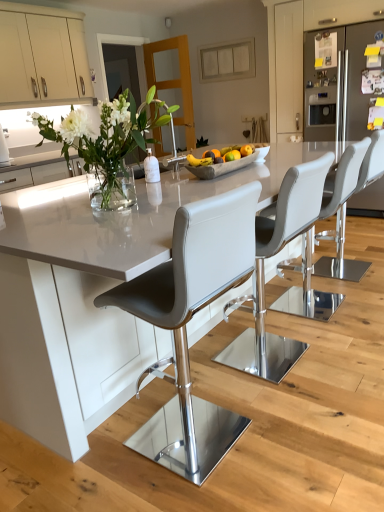
Question: Would you say white leather bar stool at center, which is the second chair in front-to-back order, is part of matte gray bar stool at center, which ranks as the fourth chair in front-to-back order,'s contents?

Choices:
 (A) no
 (B) yes

Answer: (A)

Question: Is matte gray bar stool at center, which ranks as the fourth chair in front-to-back order, at the left side of white leather bar stool at center, which is the second chair in front-to-back order?

Choices:
 (A) no
 (B) yes

Answer: (A)

Question: From the image's perspective, is matte gray bar stool at center, which is counted as the first chair, starting from the back, above white leather bar stool at center, which is the second chair in front-to-back order?

Choices:
 (A) yes
 (B) no

Answer: (A)

Question: From a real-world perspective, is matte gray bar stool at center, which is counted as the first chair, starting from the back, on top of white leather bar stool at center, which is the second chair in front-to-back order?

Choices:
 (A) yes
 (B) no

Answer: (B)

Question: Is matte gray bar stool at center, which is counted as the first chair, starting from the back, looking in the opposite direction of white leather bar stool at center, which is the second chair in front-to-back order?

Choices:
 (A) yes
 (B) no

Answer: (B)

Question: From a real-world perspective, is white leather bar stool at center, which is the second chair in front-to-back order, positioned above or below matte gray bar stool at center, positioned as the fourth chair in back-to-front order?

Choices:
 (A) above
 (B) below

Answer: (B)

Question: In terms of size, does white leather bar stool at center, which is the second chair in front-to-back order, appear bigger or smaller than matte gray bar stool at center, acting as the first chair starting from the front?

Choices:
 (A) small
 (B) big

Answer: (B)

Question: From their relative heights in the image, would you say white leather bar stool at center, which ranks as the 3th chair in back-to-front order, is taller or shorter than matte gray bar stool at center, acting as the first chair starting from the front?

Choices:
 (A) tall
 (B) short

Answer: (B)

Question: Considering the positions of point (327, 162) and point (215, 436), is point (327, 162) closer or farther from the camera than point (215, 436)?

Choices:
 (A) farther
 (B) closer

Answer: (B)

Question: From the image's perspective, is white glossy table at center positioned above or below matte gray bar stool at center, acting as the first chair starting from the front?

Choices:
 (A) below
 (B) above

Answer: (B)

Question: Is white glossy table at center wider or thinner than matte gray bar stool at center, positioned as the fourth chair in back-to-front order?

Choices:
 (A) thin
 (B) wide

Answer: (B)

Question: Does point (72, 224) appear closer or farther from the camera than point (253, 202)?

Choices:
 (A) farther
 (B) closer

Answer: (A)

Question: In the image, is white glossy table at center positioned in front of or behind matte gray bar stool at center, positioned as the fourth chair in back-to-front order?

Choices:
 (A) behind
 (B) front

Answer: (B)

Question: Considering the positions of yellow matte banana at center and white glossy table at center in the image, is yellow matte banana at center wider or thinner than white glossy table at center?

Choices:
 (A) thin
 (B) wide

Answer: (A)

Question: Is yellow matte banana at center taller or shorter than white glossy table at center?

Choices:
 (A) tall
 (B) short

Answer: (B)